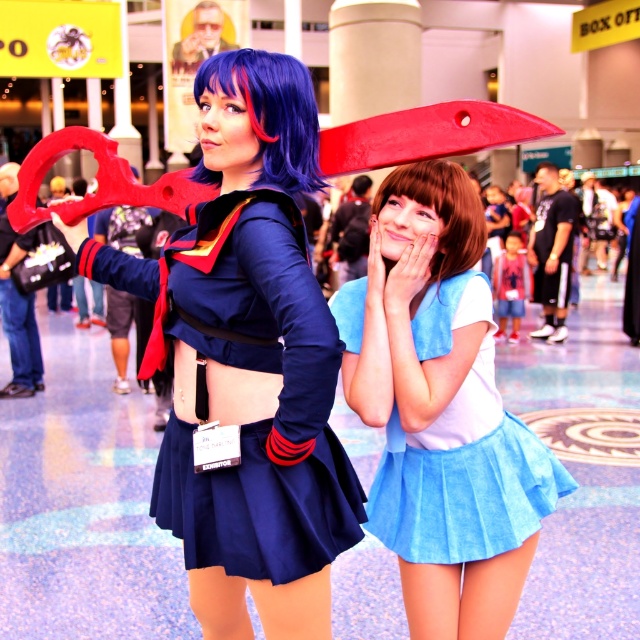
How distant is matte blue fabric skirt at center from navy blue fabric skirt at center?

They are 1.99 inches apart.

The height and width of the screenshot is (640, 640). Find the location of `matte blue fabric skirt at center`. matte blue fabric skirt at center is located at coordinates (250, 362).

At what (x,y) coordinates should I click in order to perform the action: click on matte blue fabric skirt at center. Please return your answer as a coordinate pair (x, y). Image resolution: width=640 pixels, height=640 pixels. Looking at the image, I should click on (250, 362).

Who is higher up, brown silky hair at center or light blue suede skirt at lower right?

Positioned higher is light blue suede skirt at lower right.

Consider the image. Can you confirm if brown silky hair at center is smaller than light blue suede skirt at lower right?

Yes, brown silky hair at center is smaller than light blue suede skirt at lower right.

Describe the element at coordinates (442, 211) in the screenshot. I see `brown silky hair at center` at that location.

I want to click on brown silky hair at center, so (x=442, y=211).

Is point (298, 180) in front of point (518, 257)?

That is True.

Between point (317, 145) and point (518, 266), which one is positioned behind?

Point (518, 266)

Is point (291, 109) more distant than point (497, 310)?

No.

Where is `blue synthetic wig at upper center`? This screenshot has height=640, width=640. blue synthetic wig at upper center is located at coordinates (272, 109).